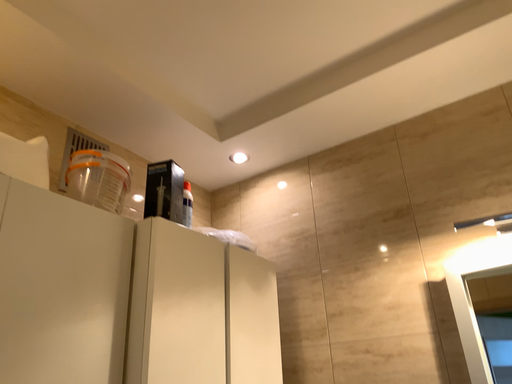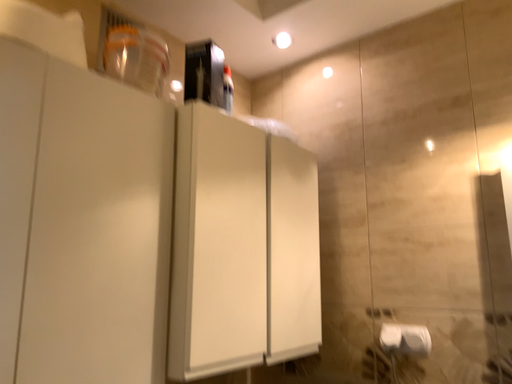
Question: Which way did the camera rotate in the video?

Choices:
 (A) rotated upward
 (B) rotated downward

Answer: (B)